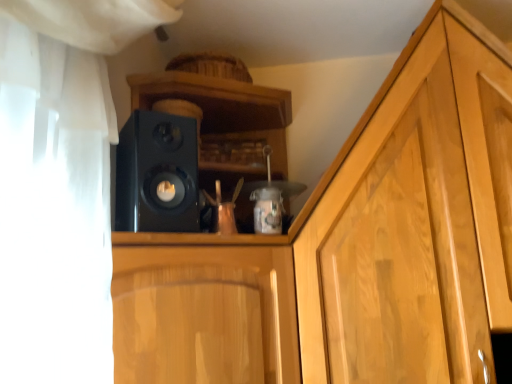
Locate an element on the screen. glossy wood cabinet at center is located at coordinates (205, 315).

What do you see at coordinates (205, 315) in the screenshot? The image size is (512, 384). I see `glossy wood cabinet at center` at bounding box center [205, 315].

This screenshot has width=512, height=384. Describe the element at coordinates (157, 174) in the screenshot. I see `black matte speaker at center` at that location.

You are a GUI agent. You are given a task and a screenshot of the screen. Output one action in this format:
    pyautogui.click(x=<x>, y=<y>)
    Task: Click on the black matte speaker at center
    
    Given the screenshot: What is the action you would take?
    pyautogui.click(x=157, y=174)

What is the approximate width of black matte speaker at center?

black matte speaker at center is 18.31 centimeters in width.

You are a GUI agent. You are given a task and a screenshot of the screen. Output one action in this format:
    pyautogui.click(x=<x>, y=<y>)
    Task: Click on the glossy wood cabinet at center
    The image size is (512, 384).
    Given the screenshot: What is the action you would take?
    pyautogui.click(x=205, y=315)

Is glossy wood cabinet at center at the left side of black matte speaker at center?

In fact, glossy wood cabinet at center is to the right of black matte speaker at center.

Is glossy wood cabinet at center in front of or behind black matte speaker at center in the image?

glossy wood cabinet at center is in front of black matte speaker at center.

Is point (212, 343) positioned after point (156, 149)?

No, it is not.

From the image's perspective, is glossy wood cabinet at center located above or below black matte speaker at center?

Clearly, from the image's perspective, glossy wood cabinet at center is below black matte speaker at center.

From a real-world perspective, is glossy wood cabinet at center located higher than black matte speaker at center?

No.

Between glossy wood cabinet at center and black matte speaker at center, which one has smaller width?

Thinner between the two is black matte speaker at center.

Considering the sizes of objects glossy wood cabinet at center and black matte speaker at center in the image provided, who is shorter, glossy wood cabinet at center or black matte speaker at center?

black matte speaker at center.

Is glossy wood cabinet at center bigger than black matte speaker at center?

Indeed, glossy wood cabinet at center has a larger size compared to black matte speaker at center.

Is glossy wood cabinet at center positioned beyond the bounds of black matte speaker at center?

Yes, glossy wood cabinet at center is not within black matte speaker at center.

Are glossy wood cabinet at center and black matte speaker at center located far from each other?

No, glossy wood cabinet at center is not far away from black matte speaker at center.

Is glossy wood cabinet at center oriented away from black matte speaker at center?

No, glossy wood cabinet at center is not facing the opposite direction of black matte speaker at center.

How many degrees apart are the facing directions of glossy wood cabinet at center and black matte speaker at center?

The angle between the facing direction of glossy wood cabinet at center and the facing direction of black matte speaker at center is 23.2 degrees.

Measure the distance between glossy wood cabinet at center and black matte speaker at center.

glossy wood cabinet at center is 7.51 inches away from black matte speaker at center.

You are a GUI agent. You are given a task and a screenshot of the screen. Output one action in this format:
    pyautogui.click(x=<x>, y=<y>)
    Task: Click on the cabinetry below the black matte speaker at center (from a real-world perspective)
    This screenshot has width=512, height=384.
    Given the screenshot: What is the action you would take?
    pyautogui.click(x=205, y=315)

Considering the relative positions of black matte speaker at center and glossy wood cabinet at center in the image provided, is black matte speaker at center to the right of glossy wood cabinet at center from the viewer's perspective?

In fact, black matte speaker at center is to the left of glossy wood cabinet at center.

Looking at this image, relative to glossy wood cabinet at center, is black matte speaker at center in front or behind?

Visually, black matte speaker at center is located behind glossy wood cabinet at center.

Does point (159, 219) lie in front of point (283, 253)?

Yes, point (159, 219) is in front of point (283, 253).

From the picture: From the image's perspective, would you say black matte speaker at center is positioned over glossy wood cabinet at center?

Yes.

From a real-world perspective, between black matte speaker at center and glossy wood cabinet at center, who is vertically lower?

glossy wood cabinet at center is physically lower.

Can you confirm if black matte speaker at center is thinner than glossy wood cabinet at center?

Indeed, black matte speaker at center has a lesser width compared to glossy wood cabinet at center.

From their relative heights in the image, would you say black matte speaker at center is taller or shorter than glossy wood cabinet at center?

Clearly, black matte speaker at center is shorter compared to glossy wood cabinet at center.

Considering the relative sizes of black matte speaker at center and glossy wood cabinet at center in the image provided, is black matte speaker at center bigger than glossy wood cabinet at center?

Incorrect, black matte speaker at center is not larger than glossy wood cabinet at center.

Can we say black matte speaker at center lies outside glossy wood cabinet at center?

That's correct, black matte speaker at center is outside of glossy wood cabinet at center.

Is black matte speaker at center beside glossy wood cabinet at center?

No, black matte speaker at center is not beside glossy wood cabinet at center.

Is black matte speaker at center positioned with its back to glossy wood cabinet at center?

black matte speaker at center does not have its back to glossy wood cabinet at center.

How different are the orientations of black matte speaker at center and glossy wood cabinet at center in degrees?

The angular difference between black matte speaker at center and glossy wood cabinet at center is 23.2 degrees.

The width and height of the screenshot is (512, 384). Identify the location of speaker above the glossy wood cabinet at center (from the image's perspective). (157, 174).

Find the location of a particular element. This screenshot has height=384, width=512. cabinetry below the black matte speaker at center (from a real-world perspective) is located at coordinates (205, 315).

At what (x,y) coordinates should I click in order to perform the action: click on speaker on the left of glossy wood cabinet at center. Please return your answer as a coordinate pair (x, y). This screenshot has height=384, width=512. Looking at the image, I should click on (157, 174).